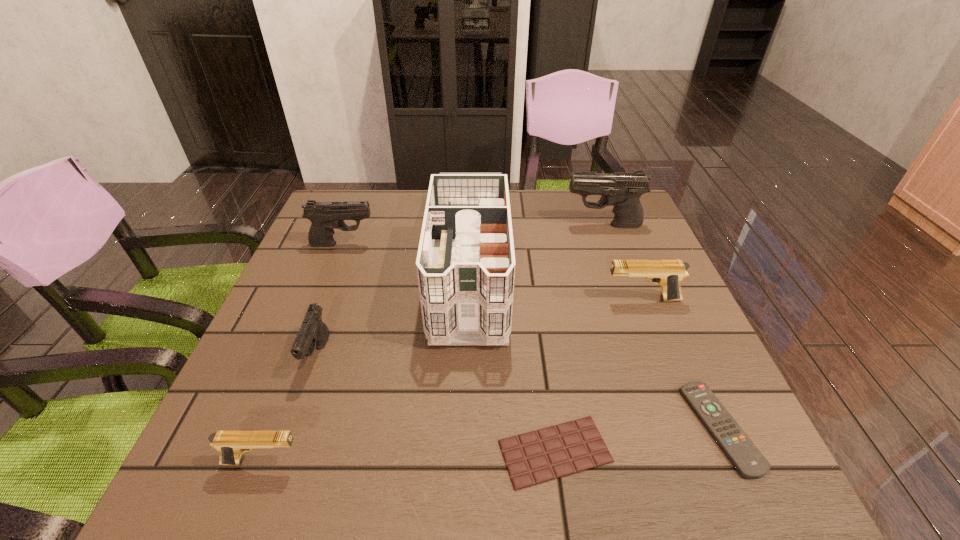
Find the location of a particular element. pistol that stands as the closest to the seventh tallest object is located at coordinates (668, 274).

At what (x,y) coordinates should I click in order to perform the action: click on pistol that stands as the third closest to the shortest object. Please return your answer as a coordinate pair (x, y). This screenshot has width=960, height=540. Looking at the image, I should click on (313, 333).

Locate an element on the screen. black pistol that is the closest to the third tallest object is located at coordinates (313, 333).

Find the location of `black pistol that is the second closest to the nearest black pistol`. black pistol that is the second closest to the nearest black pistol is located at coordinates (622, 190).

Find the location of a particular element. The height and width of the screenshot is (540, 960). vacant position in the image that satisfies the following two spatial constraints: 1. at the barrel of the second shortest object; 2. on the left side of the nearest black pistol is located at coordinates (293, 428).

This screenshot has height=540, width=960. I want to click on vacant space that satisfies the following two spatial constraints: 1. at the entrance of the dollhouse; 2. on the left side of the chocolate bar, so click(x=463, y=451).

Where is `vacant space that satisfies the following two spatial constraints: 1. at the entrance of the tallest object; 2. at the barrel of the third shortest object`? vacant space that satisfies the following two spatial constraints: 1. at the entrance of the tallest object; 2. at the barrel of the third shortest object is located at coordinates (463, 462).

The width and height of the screenshot is (960, 540). In order to click on free region that satisfies the following two spatial constraints: 1. at the barrel of the smallest black pistol; 2. at the barrel of the sixth tallest object in this screenshot , I will do `click(280, 462)`.

Where is `blank space that satisfies the following two spatial constraints: 1. at the barrel of the farthest black pistol; 2. on the back side of the seventh tallest object`? blank space that satisfies the following two spatial constraints: 1. at the barrel of the farthest black pistol; 2. on the back side of the seventh tallest object is located at coordinates (679, 428).